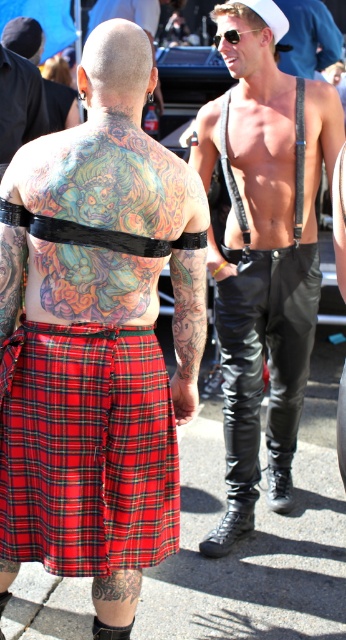
Question: Which object is the closest to the shiny leather pants at right?

Choices:
 (A) dark brown leather belt at lower center
 (B) shiny black leather pants at center
 (C) red plaid skirt at lower left

Answer: (C)

Question: Is shiny black leather pants at center in front of red plaid skirt at lower left?

Choices:
 (A) no
 (B) yes

Answer: (A)

Question: Which of these objects is positioned closest to the red plaid skirt at lower left?

Choices:
 (A) dark brown leather belt at lower center
 (B) shiny leather pants at right
 (C) shiny black leather pants at center

Answer: (B)

Question: Can you confirm if shiny black leather pants at center is positioned to the left of dark brown leather belt at lower center?

Choices:
 (A) no
 (B) yes

Answer: (A)

Question: Which object appears closest to the camera in this image?

Choices:
 (A) shiny leather pants at right
 (B) dark brown leather belt at lower center
 (C) shiny black leather pants at center

Answer: (A)

Question: Does shiny black leather pants at center have a lesser width compared to red plaid skirt at lower left?

Choices:
 (A) yes
 (B) no

Answer: (B)